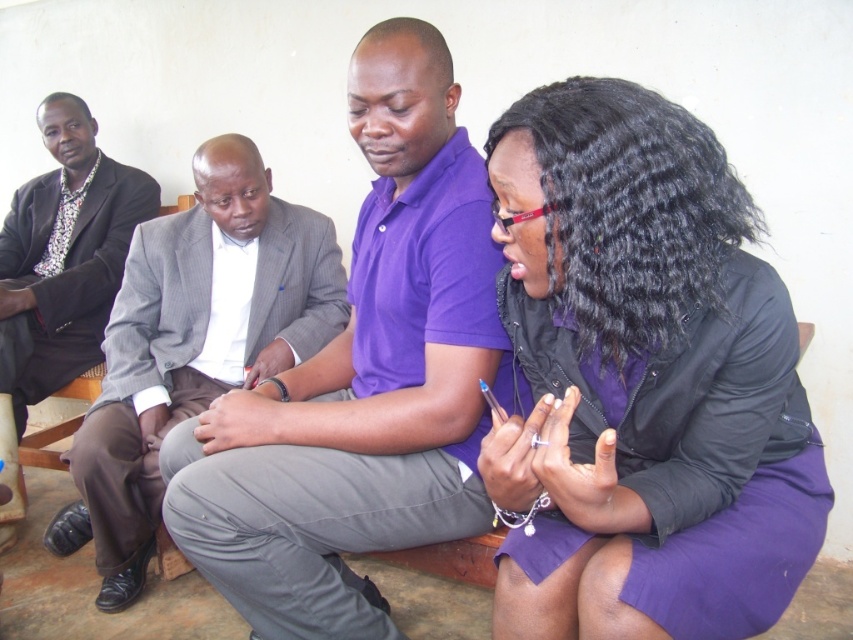
Question: Considering the relative positions of gray pinstripe suit at left and matte black suit at left in the image provided, where is gray pinstripe suit at left located with respect to matte black suit at left?

Choices:
 (A) right
 (B) left

Answer: (A)

Question: Based on their relative distances, which object is farther from the purple matte skirt at lower right?

Choices:
 (A) matte black suit at left
 (B) gray pinstripe suit at left
 (C) purple cotton polo shirt at center

Answer: (A)

Question: Which object appears farthest from the camera in this image?

Choices:
 (A) purple cotton polo shirt at center
 (B) gray pinstripe suit at left

Answer: (B)

Question: Is purple matte skirt at lower right to the left of purple cotton polo shirt at center from the viewer's perspective?

Choices:
 (A) no
 (B) yes

Answer: (A)

Question: Is purple matte skirt at lower right wider than gray pinstripe suit at left?

Choices:
 (A) no
 (B) yes

Answer: (A)

Question: Which point is closer to the camera?

Choices:
 (A) (473, 250)
 (B) (622, 374)

Answer: (B)